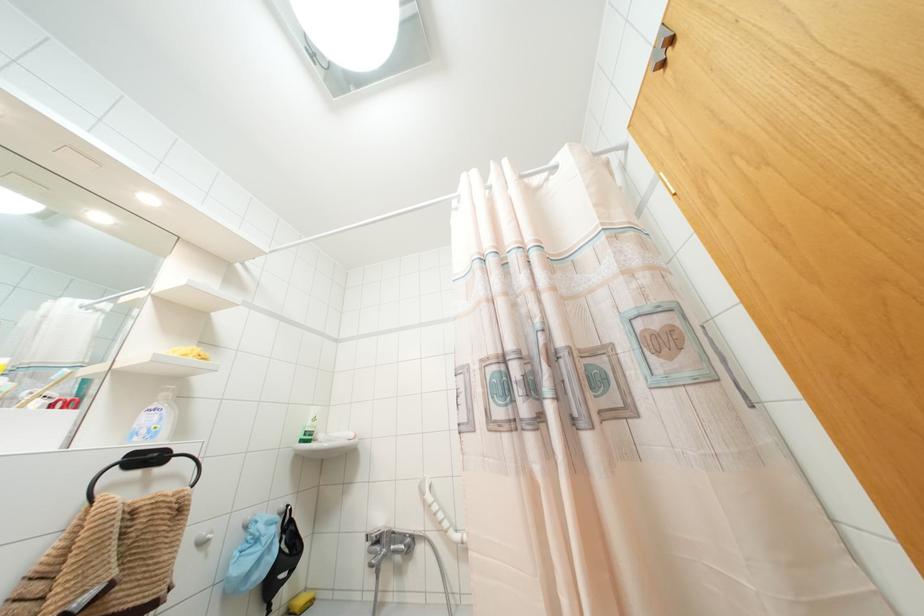
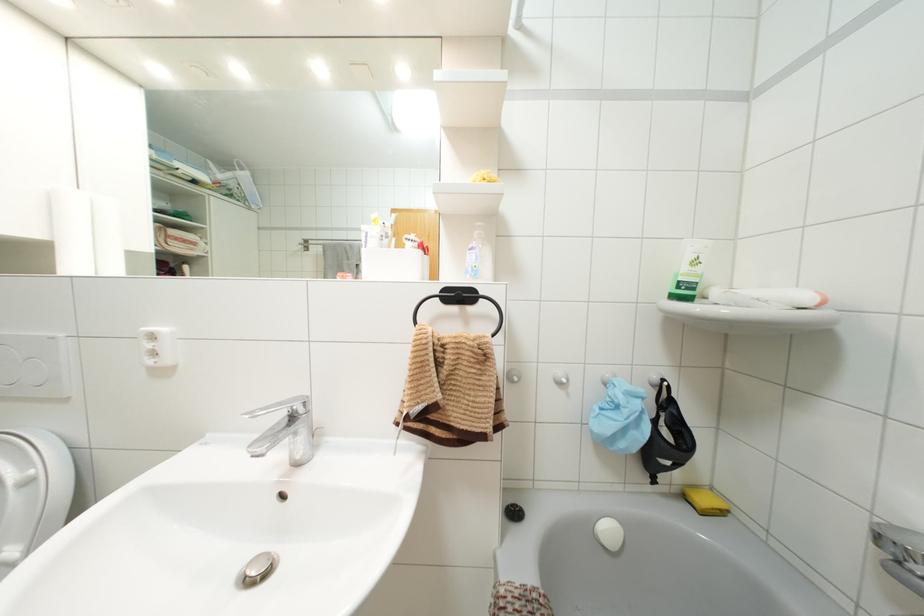
Find the pixel in the second image that matches [312,419] in the first image.

(695, 262)